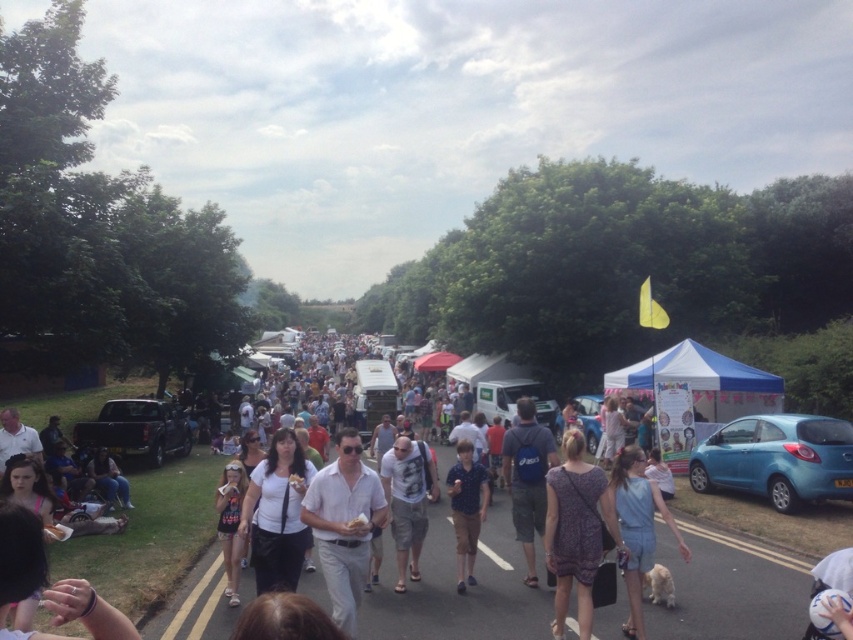
Measure the distance between point (410, 460) and camera.

Point (410, 460) is 29.75 feet away from camera.

Which of these two, white cotton t-shirt at center or blue cotton shirt at center, stands taller?

white cotton t-shirt at center

Describe the element at coordinates (407, 500) in the screenshot. The height and width of the screenshot is (640, 853). I see `white cotton t-shirt at center` at that location.

This screenshot has width=853, height=640. I want to click on white cotton t-shirt at center, so click(407, 500).

Is matte blue hatchback at right smaller than white matte shirt at center?

Actually, matte blue hatchback at right might be larger than white matte shirt at center.

Is matte blue hatchback at right shorter than white matte shirt at center?

No.

Locate an element on the screen. matte blue hatchback at right is located at coordinates (776, 460).

Does white matte shirt at center have a larger size compared to dark blue backpack at center?

Correct, white matte shirt at center is larger in size than dark blue backpack at center.

Is white matte shirt at center positioned at the back of dark blue backpack at center?

That is False.

Where is `white matte shirt at center`? Image resolution: width=853 pixels, height=640 pixels. white matte shirt at center is located at coordinates (277, 513).